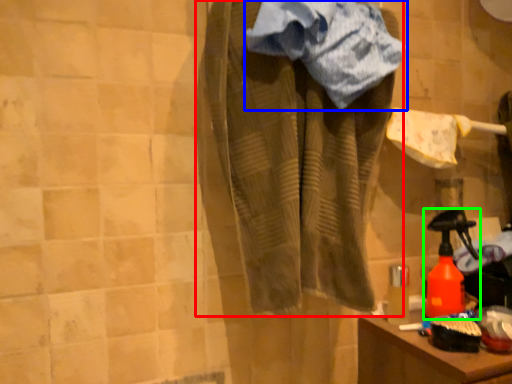
Question: Based on their relative distances, which object is farther from clothing (highlighted by a red box)? Choose from towel (highlighted by a blue box) and bottle (highlighted by a green box).

Choices:
 (A) towel
 (B) bottle

Answer: (B)